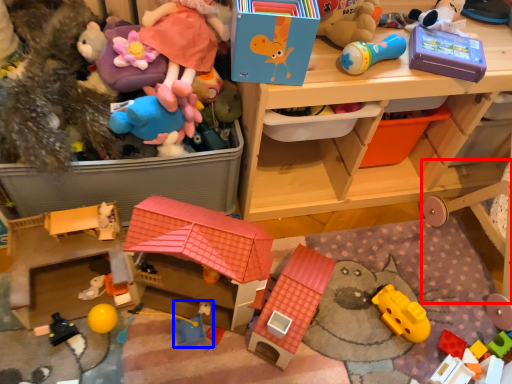
Question: Which point is closer to the camera, bunk bed (highlighted by a red box) or toy (highlighted by a blue box)?

Choices:
 (A) bunk bed
 (B) toy

Answer: (A)